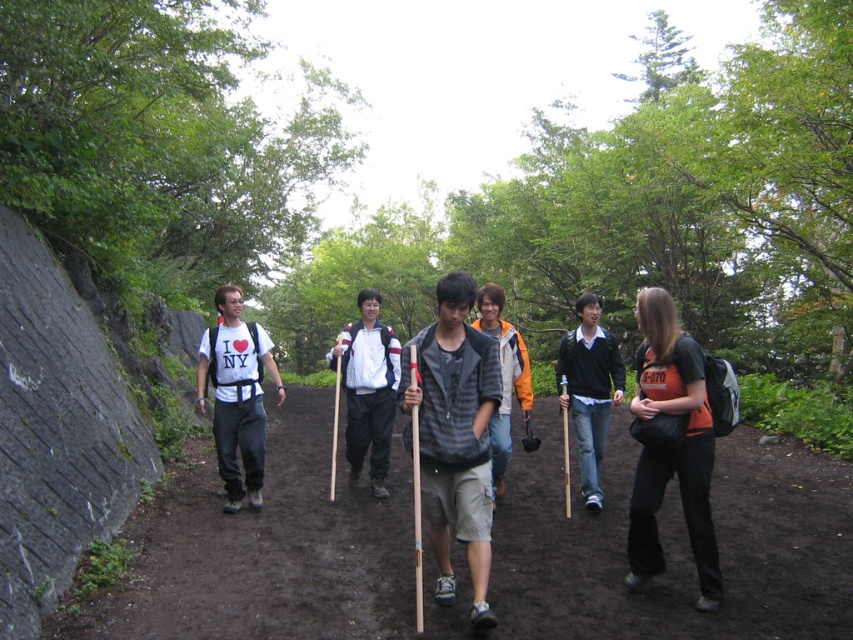
You are navigating through a forest and want to stay on the main path. Based on the image, where is the brown dirt path at center located?

The brown dirt path at center is located at point [674,544].

You are part of a hiking group on a dirt path in a forest. You want to take a photo of a specific point located at coordinates point [834,634]. If your camera can focus on objects up to 15 feet away, will you be able to capture the point clearly?

The distance between point [834,634] and the camera is 13.56 feet, which is within the camera focus range of up to 15 feet. Therefore, you can capture the point clearly.